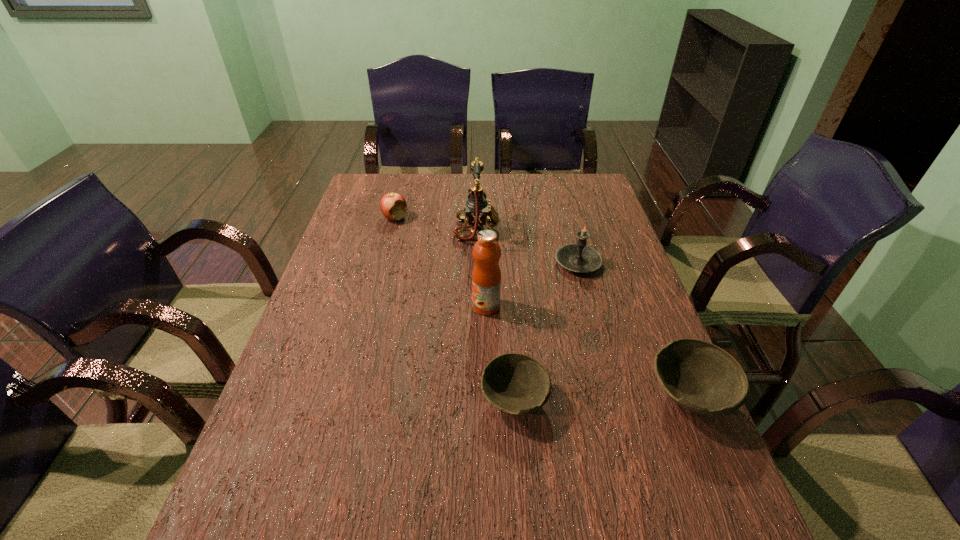
The width and height of the screenshot is (960, 540). In order to click on vacant point that satisfies the following two spatial constraints: 1. on the front label of the fourth farthest object; 2. on the back side of the taller bowl in this screenshot , I will do `click(488, 396)`.